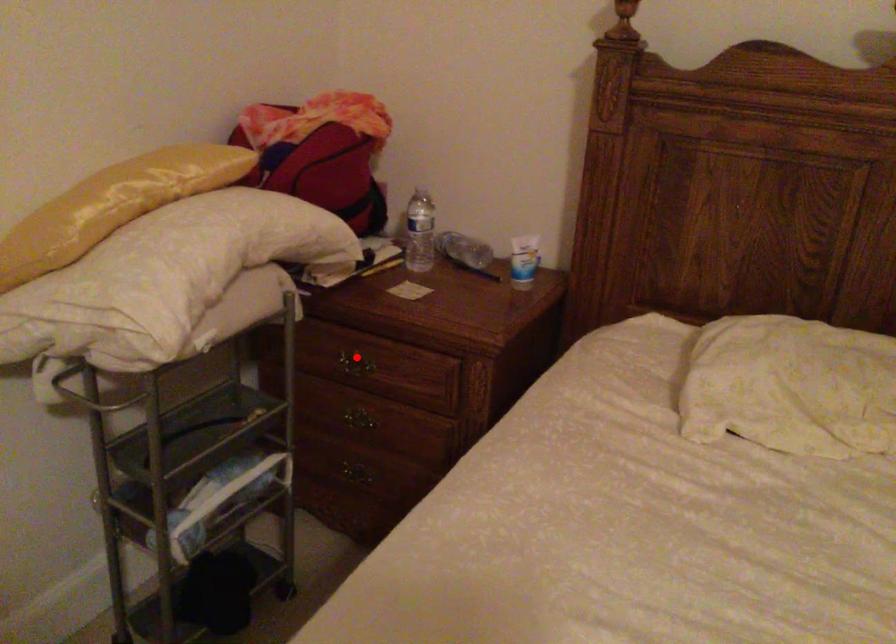
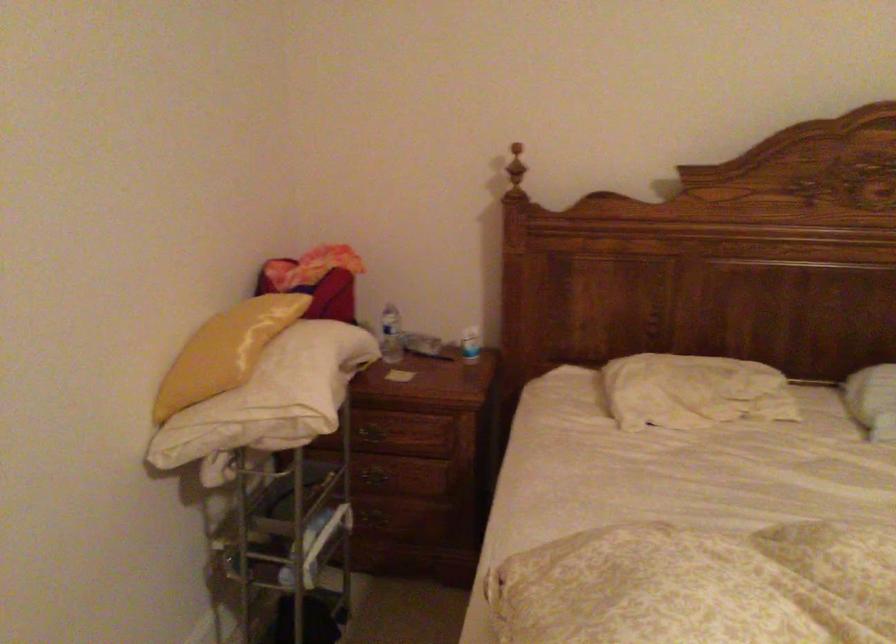
Where in the second image is the point corresponding to the highlighted location from the first image?

(374, 430)